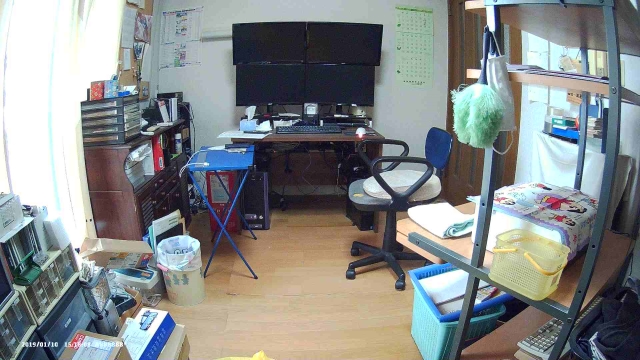
In order to click on window in this screenshot , I will do `click(49, 128)`.